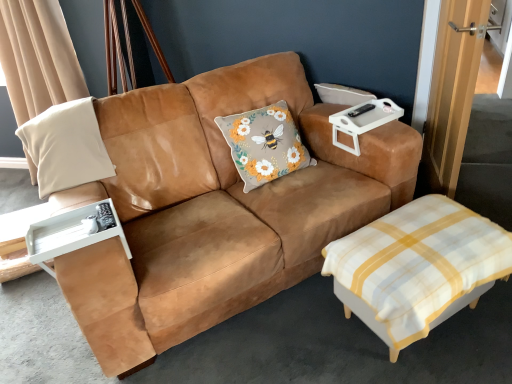
Question: Is white checkered ottoman at lower right wider or thinner than suede tan couch at center?

Choices:
 (A) wide
 (B) thin

Answer: (B)

Question: Looking at the image, does white checkered ottoman at lower right seem bigger or smaller compared to suede tan couch at center?

Choices:
 (A) big
 (B) small

Answer: (B)

Question: Estimate the real-world distances between objects in this image. Which object is farther from the white plastic tray at left?

Choices:
 (A) wooden door at right
 (B) white plastic tray at upper right
 (C) fluffy beige cushion with floral design at center
 (D) white suede pillow at left
 (E) beige fabric pillow at left

Answer: (A)

Question: Estimate the real-world distances between objects in this image. Which object is closer to the suede tan couch at center?

Choices:
 (A) white checkered ottoman at lower right
 (B) white suede pillow at left
 (C) fluffy beige cushion with floral design at center
 (D) white plastic tray at upper right
 (E) white plastic tray at left

Answer: (C)